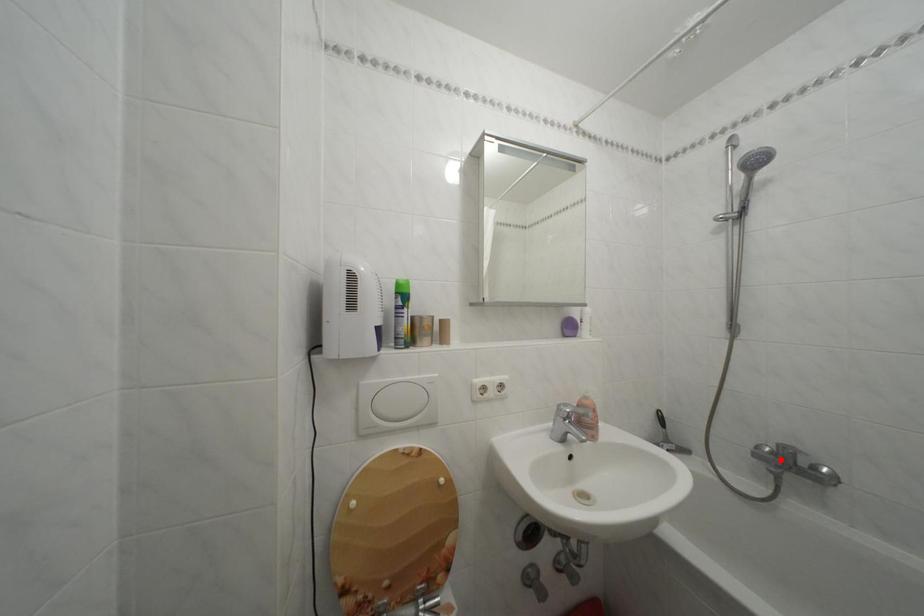
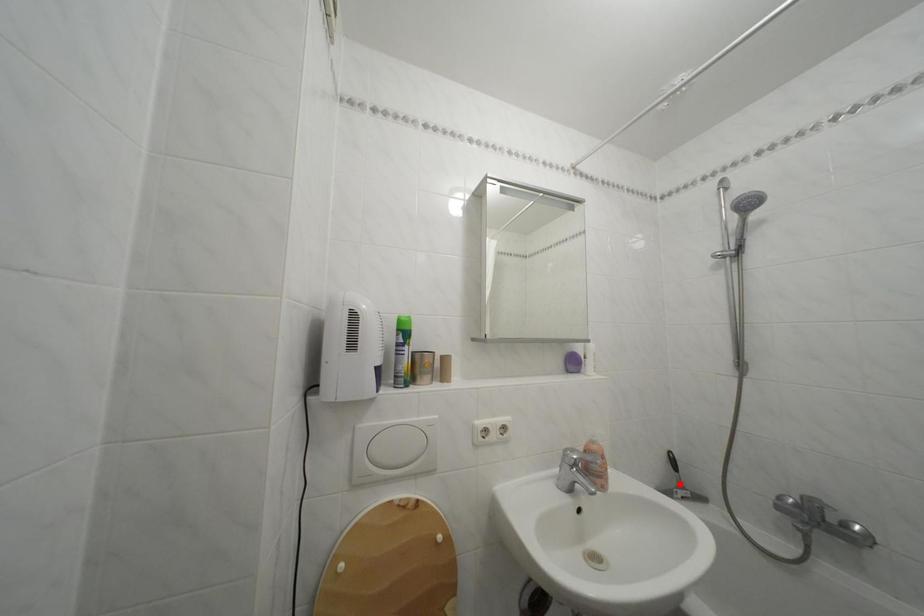
I am providing you with two images of the same scene from different viewpoints. A red point is marked on the first image and another point is marked on the second image. Is the red point in image1 aligned with the point shown in image2?

No